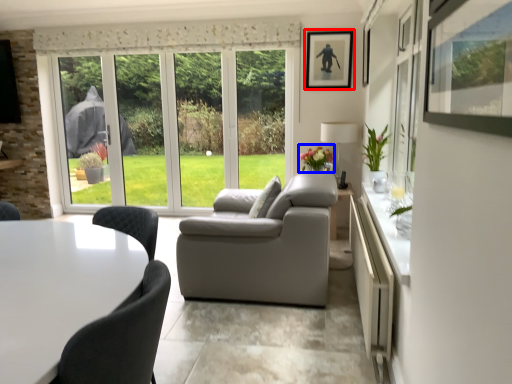
Question: Which point is closer to the camera, picture frame (highlighted by a red box) or flower (highlighted by a blue box)?

Choices:
 (A) picture frame
 (B) flower

Answer: (B)